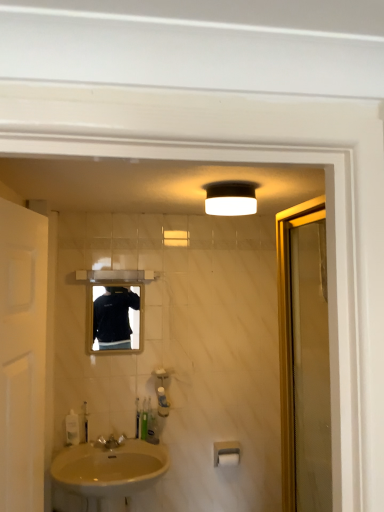
Identify the location of vacant area that is situated to the right of clear plastic bottle at lower left, which ranks as the fifth toiletry in right-to-left order. (91, 443).